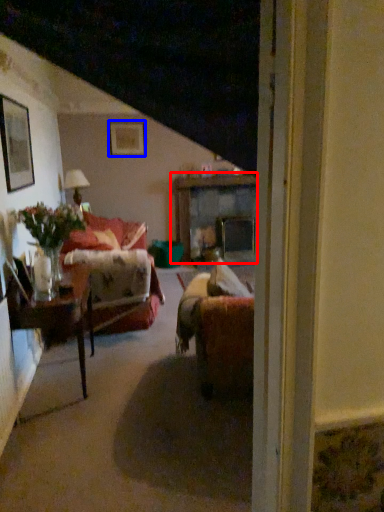
Question: Which object is closer to the camera taking this photo, table (highlighted by a red box) or picture frame (highlighted by a blue box)?

Choices:
 (A) table
 (B) picture frame

Answer: (B)